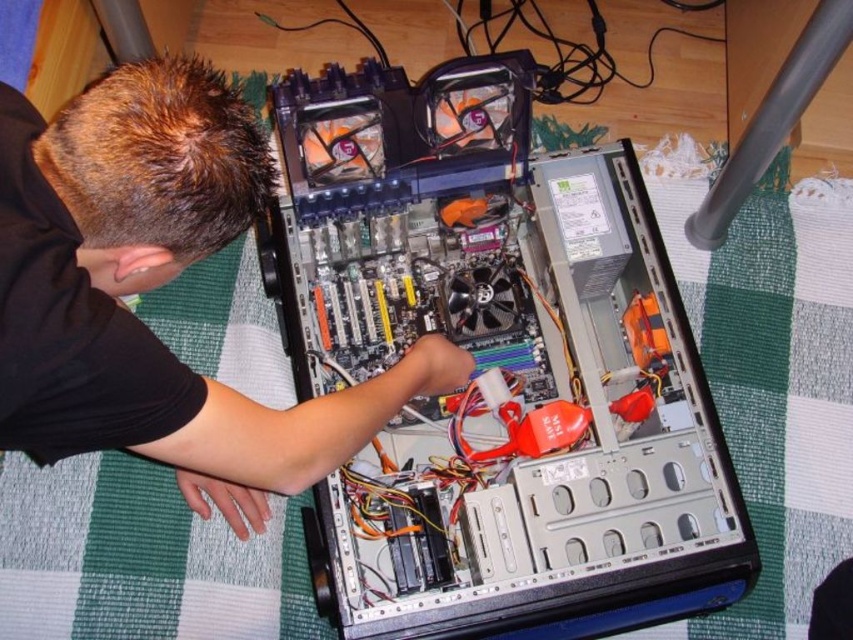
You are a technician trying to access the silver metallic computer at center. However, your view is partially blocked by the black matte shirt at upper left. Can you move the shirt to get a clearer view of the computer?

The silver metallic computer at center is positioned under the black matte shirt at upper left, so moving the shirt would allow you to see the computer more clearly.

You are a technician trying to determine if the silver metallic computer at center will fit into a storage box designed for items no taller than the black matte shirt at upper left. Based on the scene, can the computer fit into the box?

The silver metallic computer at center is taller than the black matte shirt at upper left, so it will not fit into the storage box designed for items no taller than the shirt.

You are a technician who needs to reach the power button on the front panel of the silver metallic computer at center. The power button is located 28 inches from the bottom edge of the computer. If you are standing 34.77 inches away from the computer, can you comfortably press the button without bending down?

The silver metallic computer at center is 34.77 inches away from the camera. Since the power button is 28 inches from the bottom edge, and you are standing at the camera position, you can comfortably press the button without bending down as the distance is sufficient.